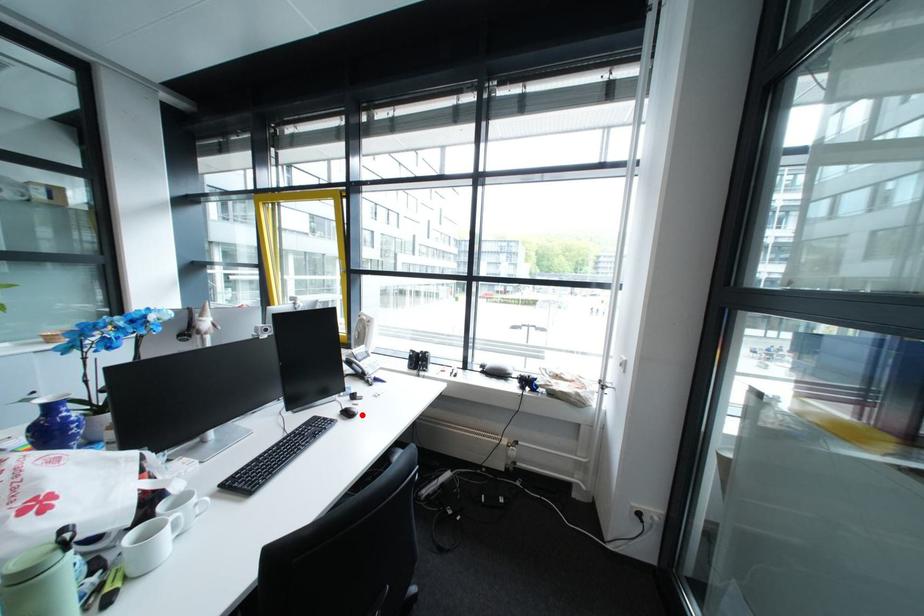
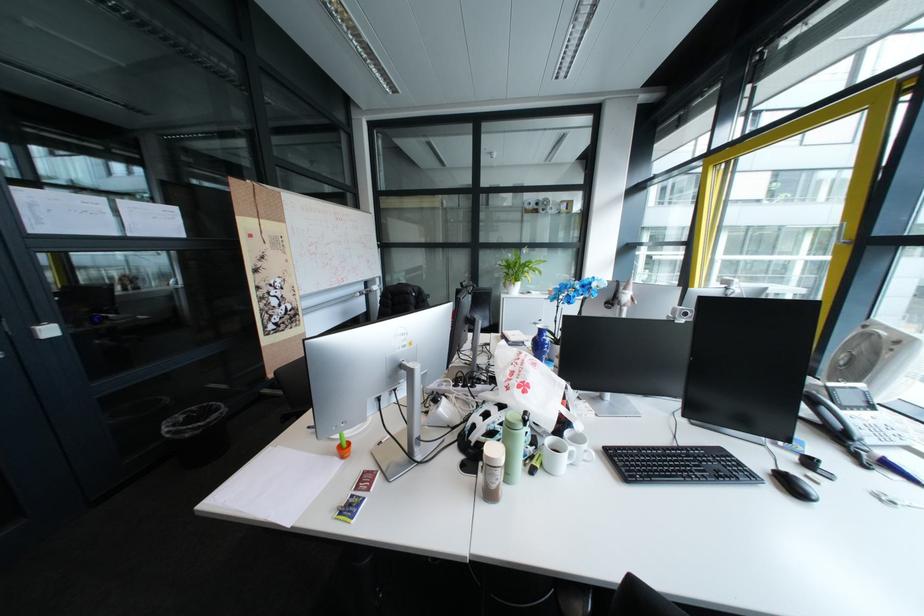
Find the pixel in the second image that matches the highlighted location in the first image.

(805, 487)